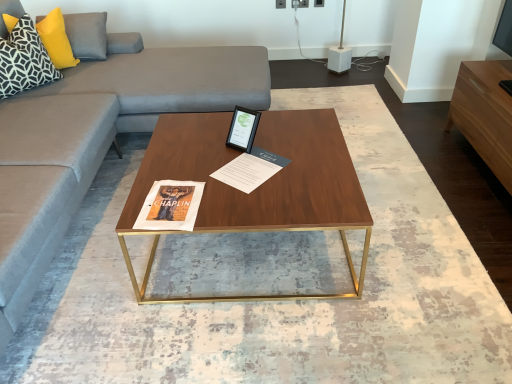
Identify the location of vacant space to the left of matte paper magazine at center. This screenshot has width=512, height=384. (192, 167).